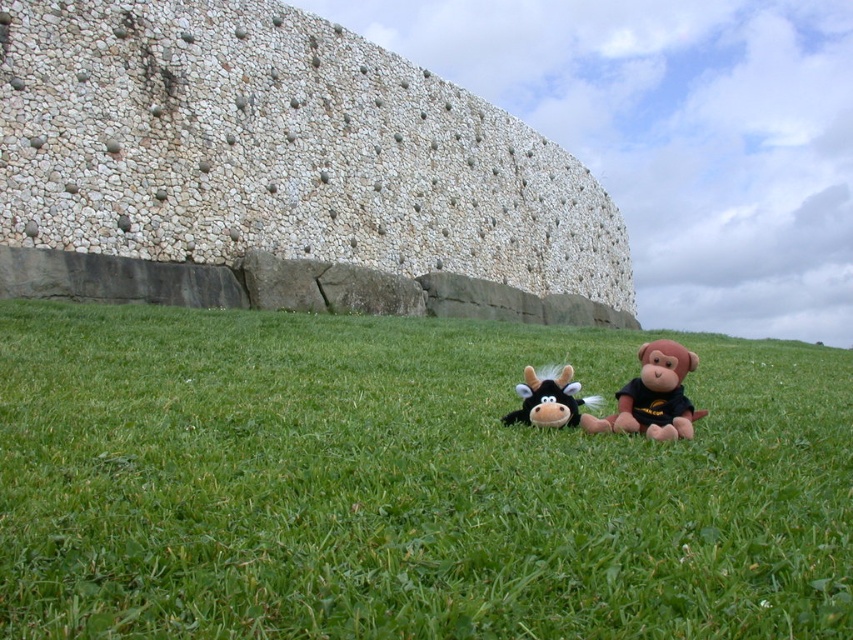
You are playing with two plush toys in a grassy field. You have the brown plush monkey at lower right and the black plush cow at center. Which toy is positioned more to the right?

The brown plush monkey at lower right is positioned more to the right than the black plush cow at center.

You are standing at the edge of the grassy field and want to place a picnic blanket between the green grass at center and the white stonework at center. If the blanket is 10 feet wide, will it fit between them without overlapping either area?

The distance between the green grass at center and the white stonework at center is 64.68 feet. Since the picnic blanket is only 10 feet wide, it will easily fit between them without overlapping either area as there is sufficient space.

You are planning to place a small garden ornament that requires a base of at least 20 cm in width. Looking at the scene, which of the two areas, the green grass at center or the white stonework at center, would be more suitable for placing the ornament based on their widths?

The white stonework at center is thicker than the green grass at center, so the white stonework at center can provide a wider base for the ornament, making it more suitable for placement.